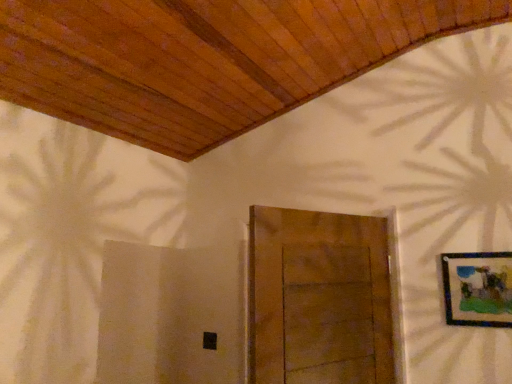
Question: Does wooden-framed artwork at upper right touch wooden door at center?

Choices:
 (A) yes
 (B) no

Answer: (B)

Question: Does wooden-framed artwork at upper right have a greater height compared to wooden door at center?

Choices:
 (A) yes
 (B) no

Answer: (B)

Question: Does wooden-framed artwork at upper right have a larger size compared to wooden door at center?

Choices:
 (A) no
 (B) yes

Answer: (A)

Question: Is wooden-framed artwork at upper right to the left of wooden door at center from the viewer's perspective?

Choices:
 (A) yes
 (B) no

Answer: (B)

Question: Is wooden-framed artwork at upper right smaller than wooden door at center?

Choices:
 (A) no
 (B) yes

Answer: (B)

Question: Can you confirm if wooden-framed artwork at upper right is thinner than wooden door at center?

Choices:
 (A) no
 (B) yes

Answer: (B)

Question: From a real-world perspective, is wooden door at center physically below wooden-framed artwork at upper right?

Choices:
 (A) yes
 (B) no

Answer: (A)

Question: Does wooden door at center come behind wooden-framed artwork at upper right?

Choices:
 (A) no
 (B) yes

Answer: (A)

Question: Is wooden door at center at the left side of wooden-framed artwork at upper right?

Choices:
 (A) yes
 (B) no

Answer: (A)

Question: From the image's perspective, is wooden door at center on top of wooden-framed artwork at upper right?

Choices:
 (A) no
 (B) yes

Answer: (A)

Question: Could wooden-framed artwork at upper right be considered to be inside wooden door at center?

Choices:
 (A) no
 (B) yes

Answer: (A)

Question: Is wooden door at center closer to the viewer compared to wooden-framed artwork at upper right?

Choices:
 (A) yes
 (B) no

Answer: (A)

Question: Choose the correct answer: Is wooden door at center inside wooden-framed artwork at upper right or outside it?

Choices:
 (A) outside
 (B) inside

Answer: (A)